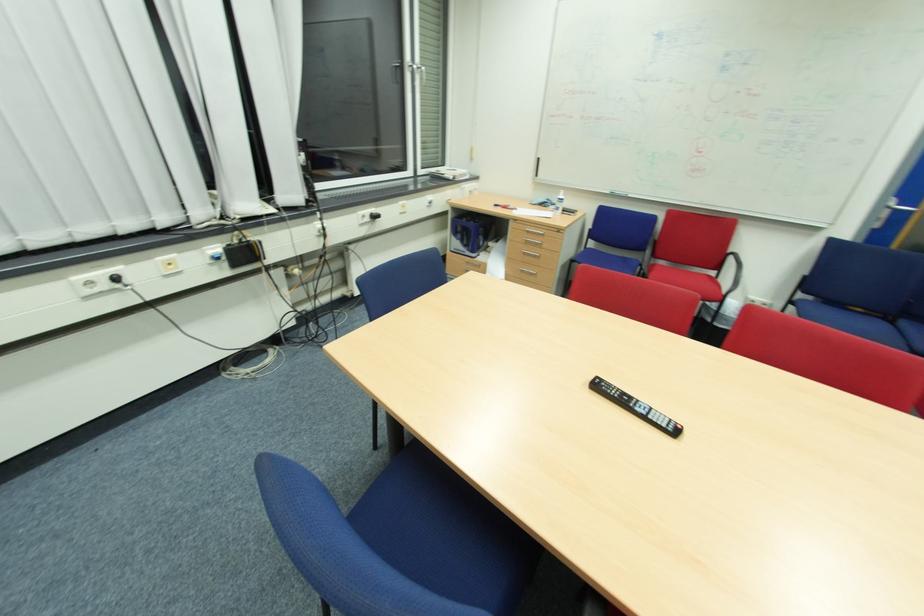
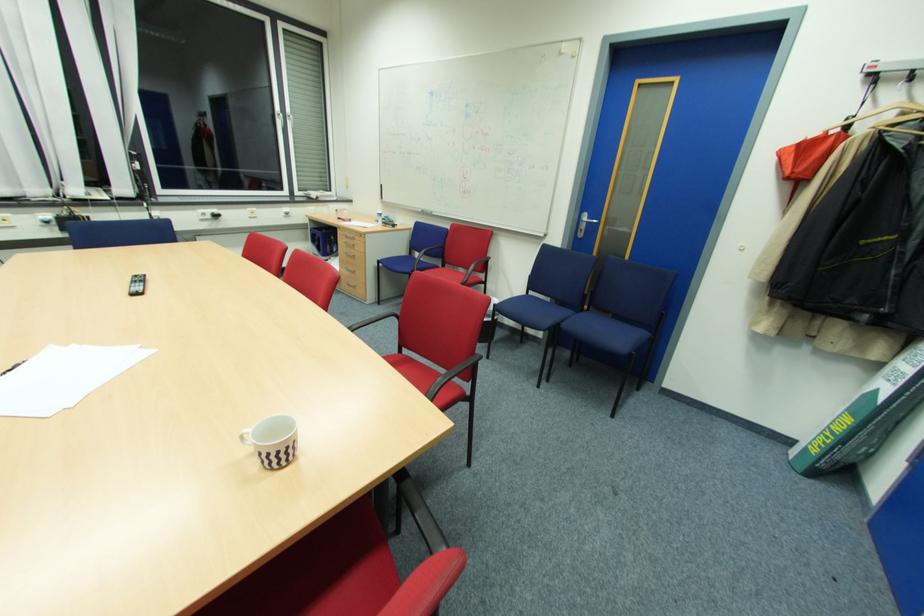
Question: I am providing you with two images of the same scene from different viewpoints. Please identify which objects are invisible in image2.

Choices:
 (A) patterned white mug
 (B) blue chair sitting surface
 (C) black remote control
 (D) orange booklet

Answer: (B)